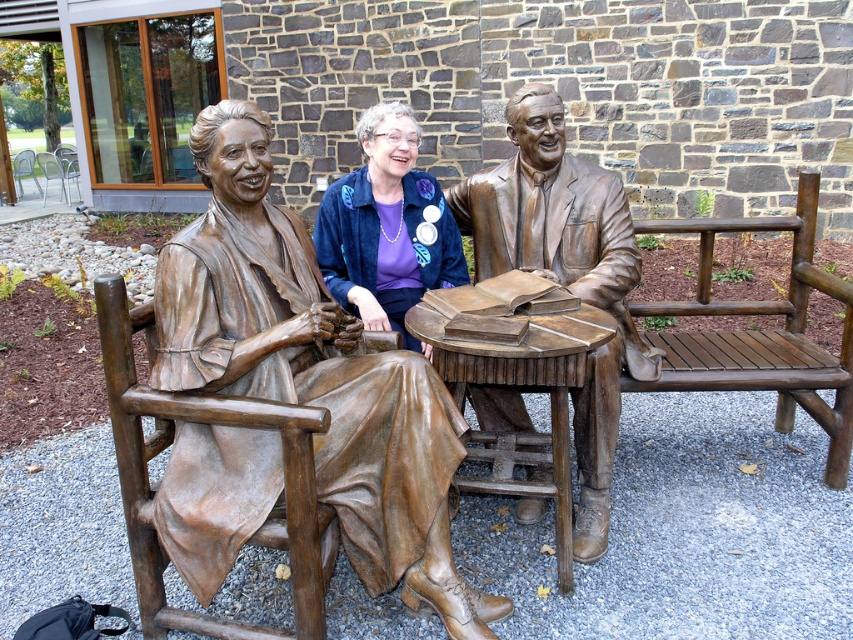
Does point (230, 456) lie in front of point (421, 291)?

That is True.

Is point (376, 390) behind point (323, 216)?

No, (376, 390) is closer to viewer.

Where is `bronze statue at center`? The image size is (853, 640). bronze statue at center is located at coordinates (312, 371).

Is bronze statue at center to the right of bronze statue of man at center from the viewer's perspective?

Incorrect, bronze statue at center is not on the right side of bronze statue of man at center.

Can you confirm if bronze statue at center is bigger than bronze statue of man at center?

No.

This screenshot has width=853, height=640. In order to click on bronze statue at center in this screenshot , I will do `click(312, 371)`.

Does bronze statue of man at center have a greater height compared to blue velvet jacket at center?

Correct, bronze statue of man at center is much taller as blue velvet jacket at center.

Does bronze statue of man at center appear on the left side of blue velvet jacket at center?

In fact, bronze statue of man at center is to the right of blue velvet jacket at center.

Who is more distant from viewer, (x=547, y=228) or (x=395, y=314)?

Point (x=395, y=314)

The height and width of the screenshot is (640, 853). Find the location of `bronze statue of man at center`. bronze statue of man at center is located at coordinates (564, 273).